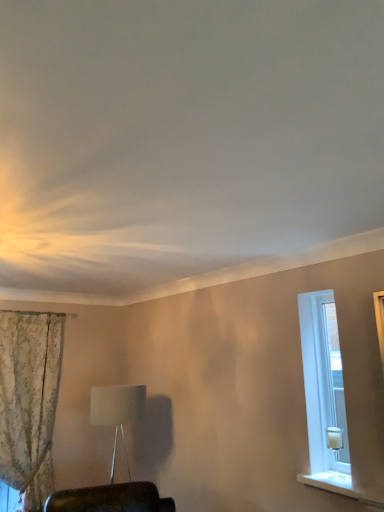
Question: From the image's perspective, is white fabric lampshade at center above floral fabric curtain at left?

Choices:
 (A) no
 (B) yes

Answer: (A)

Question: Is white fabric lampshade at center thinner than floral fabric curtain at left?

Choices:
 (A) no
 (B) yes

Answer: (A)

Question: Is white fabric lampshade at center directly adjacent to floral fabric curtain at left?

Choices:
 (A) yes
 (B) no

Answer: (B)

Question: From the image's perspective, would you say white fabric lampshade at center is shown under floral fabric curtain at left?

Choices:
 (A) no
 (B) yes

Answer: (B)

Question: Would you consider white fabric lampshade at center to be distant from floral fabric curtain at left?

Choices:
 (A) yes
 (B) no

Answer: (B)

Question: Considering the positions of floral fabric curtain at left and white smooth window sill at lower right in the image, is floral fabric curtain at left bigger or smaller than white smooth window sill at lower right?

Choices:
 (A) big
 (B) small

Answer: (A)

Question: From a real-world perspective, is floral fabric curtain at left physically located above or below white smooth window sill at lower right?

Choices:
 (A) above
 (B) below

Answer: (A)

Question: Considering the positions of point (41, 343) and point (372, 487), is point (41, 343) closer or farther from the camera than point (372, 487)?

Choices:
 (A) farther
 (B) closer

Answer: (A)

Question: Considering their positions, is floral fabric curtain at left located in front of or behind white smooth window sill at lower right?

Choices:
 (A) front
 (B) behind

Answer: (B)

Question: Considering the relative positions of white fabric lampshade at center and white smooth window sill at lower right in the image provided, is white fabric lampshade at center to the left or to the right of white smooth window sill at lower right?

Choices:
 (A) right
 (B) left

Answer: (B)

Question: Relative to white smooth window sill at lower right, is white fabric lampshade at center in front or behind?

Choices:
 (A) front
 (B) behind

Answer: (B)

Question: Is white fabric lampshade at center bigger or smaller than white smooth window sill at lower right?

Choices:
 (A) big
 (B) small

Answer: (A)

Question: In terms of width, does white fabric lampshade at center look wider or thinner when compared to white smooth window sill at lower right?

Choices:
 (A) wide
 (B) thin

Answer: (A)

Question: Considering the positions of point (344, 475) and point (332, 453), is point (344, 475) closer or farther from the camera than point (332, 453)?

Choices:
 (A) closer
 (B) farther

Answer: (A)

Question: Considering the positions of white smooth window sill at lower right and white glass candle at right in the image, is white smooth window sill at lower right wider or thinner than white glass candle at right?

Choices:
 (A) thin
 (B) wide

Answer: (B)